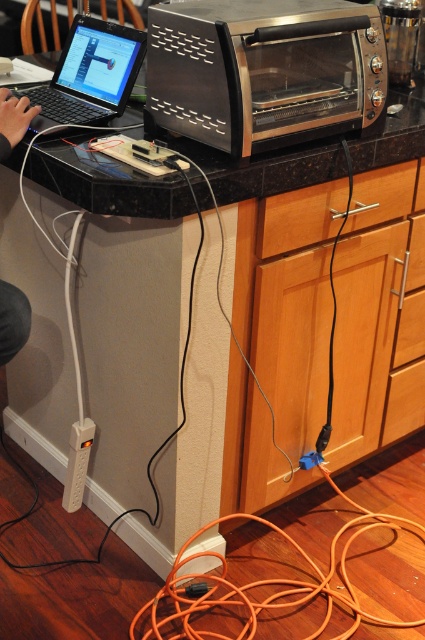
You are organizing the kitchen counter and need to place both the satin metallic toaster oven at upper right and the skinny jeans at lower left. Given their sizes, which object should you prioritize moving to free up more space?

The satin metallic toaster oven at upper right is larger in size than the skinny jeans at lower left, so you should prioritize moving the satin metallic toaster oven at upper right to free up more space.